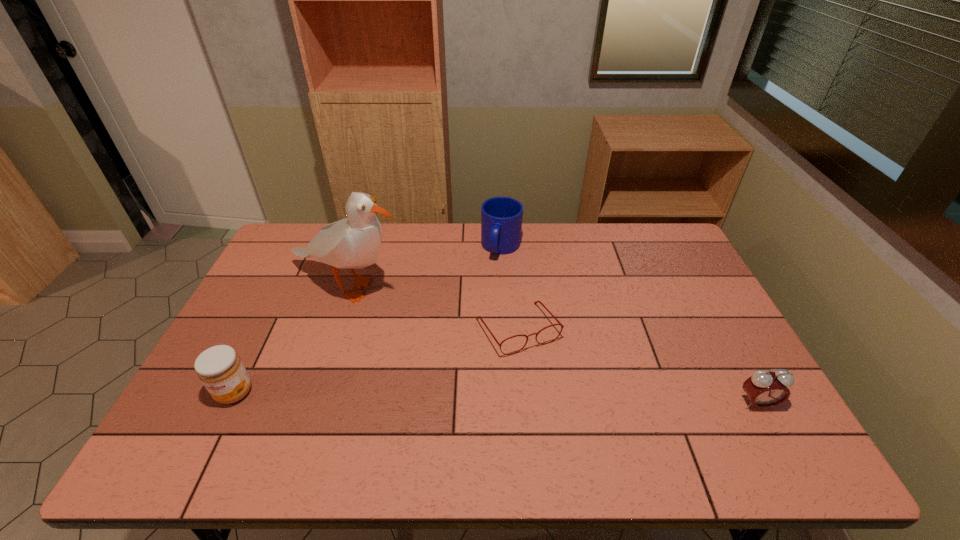
Choose which object is the second nearest neighbor to the gull. Please provide its 2D coordinates. Your answer should be formatted as a tuple, i.e. [(x, y)], where the tuple contains the x and y coordinates of a point satisfying the conditions above.

[(501, 217)]

Point out which object is positioned as the nearest to the gull. Please provide its 2D coordinates. Your answer should be formatted as a tuple, i.e. [(x, y)], where the tuple contains the x and y coordinates of a point satisfying the conditions above.

[(541, 303)]

The image size is (960, 540). I want to click on free space in the image that satisfies the following two spatial constraints: 1. on the front side of the gull; 2. on the right side of the spectacles, so click(x=333, y=329).

Locate an element on the screen. vacant space that satisfies the following two spatial constraints: 1. on the front side of the mug; 2. on the right side of the spectacles is located at coordinates (506, 329).